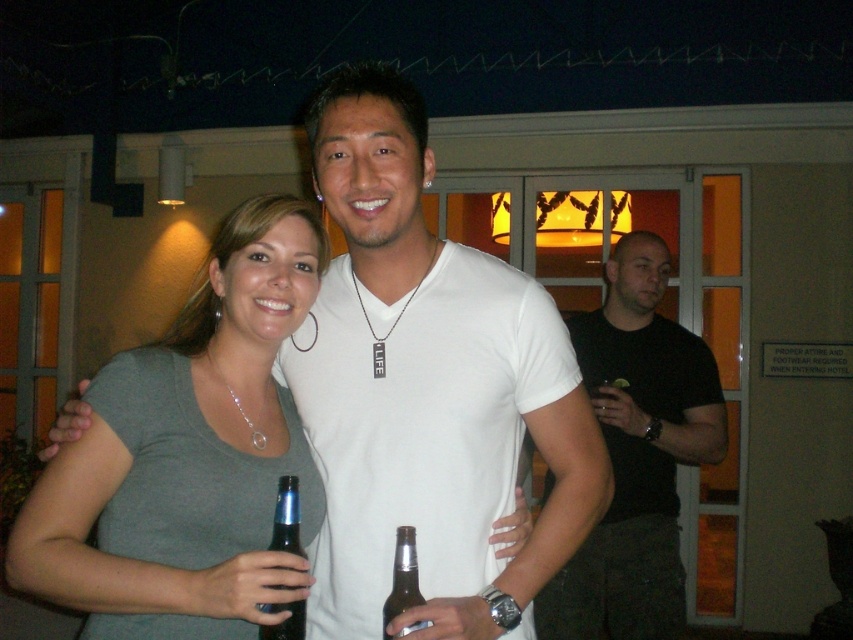
Question: Is white matte t-shirt at center positioned behind black matte shirt at right?

Choices:
 (A) yes
 (B) no

Answer: (B)

Question: Where is gray matte shirt at center located in relation to blue glass bottle at center in the image?

Choices:
 (A) right
 (B) left

Answer: (B)

Question: In this image, where is white matte t-shirt at center located relative to blue glass bottle at center?

Choices:
 (A) above
 (B) below

Answer: (A)

Question: Which of the following is the farthest from the observer?

Choices:
 (A) gray matte shirt at center
 (B) black matte shirt at right
 (C) white matte t-shirt at center

Answer: (B)

Question: Which point appears farthest from the camera in this image?

Choices:
 (A) (397, 540)
 (B) (289, 278)
 (C) (438, 392)
 (D) (708, 400)

Answer: (D)

Question: Which of the following is the farthest from the observer?

Choices:
 (A) brown glass bottle at center
 (B) gray matte shirt at center

Answer: (A)